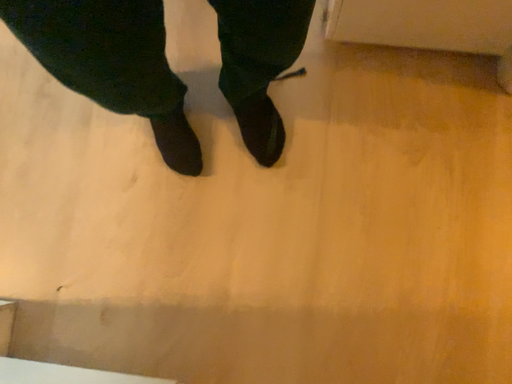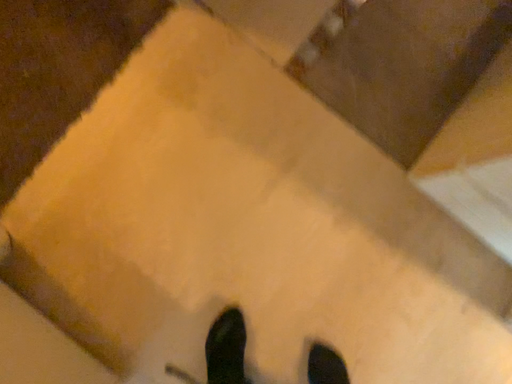
Question: How did the camera likely rotate when shooting the video?

Choices:
 (A) rotated upward
 (B) rotated downward

Answer: (A)